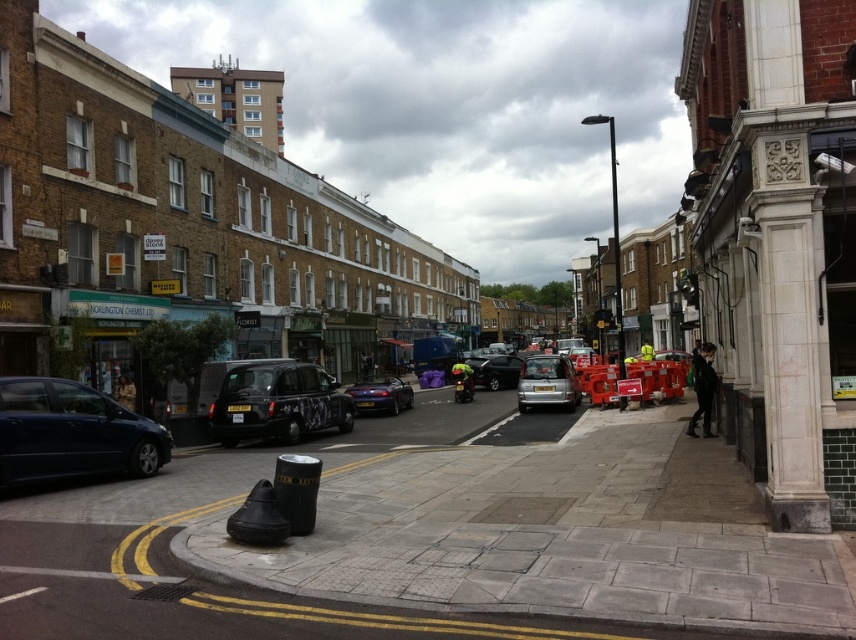
Question: Estimate the real-world distances between objects in this image. Which object is farther from the glossy metallic car at center?

Choices:
 (A) silver metallic van at center
 (B) black matte taxi at center
 (C) shiny dark blue sedan at lower left

Answer: (C)

Question: Is shiny dark blue sedan at lower left below silver metallic van at center?

Choices:
 (A) yes
 (B) no

Answer: (A)

Question: Is shiny dark blue sedan at lower left positioned before silver metallic van at center?

Choices:
 (A) yes
 (B) no

Answer: (A)

Question: Which object appears closest to the camera in this image?

Choices:
 (A) glossy metallic car at center
 (B) shiny dark blue sedan at lower left
 (C) black matte taxi at center
 (D) silver metallic van at center

Answer: (B)

Question: Is the position of shiny dark blue sedan at lower left less distant than that of silver metallic van at center?

Choices:
 (A) no
 (B) yes

Answer: (B)

Question: Which object is farther from the camera taking this photo?

Choices:
 (A) black matte taxi at center
 (B) shiny dark blue sedan at lower left
 (C) silver metallic van at center
 (D) glossy metallic car at center

Answer: (D)